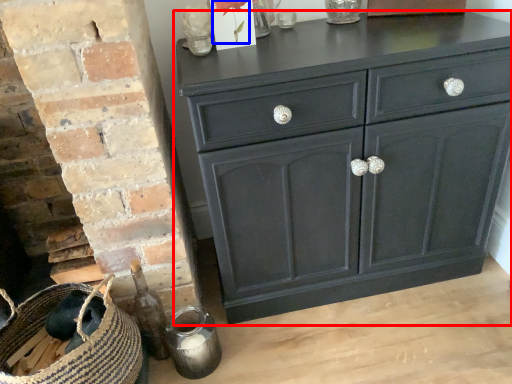
Question: Which object is further to the camera taking this photo, chest of drawers (highlighted by a red box) or flower (highlighted by a blue box)?

Choices:
 (A) chest of drawers
 (B) flower

Answer: (B)